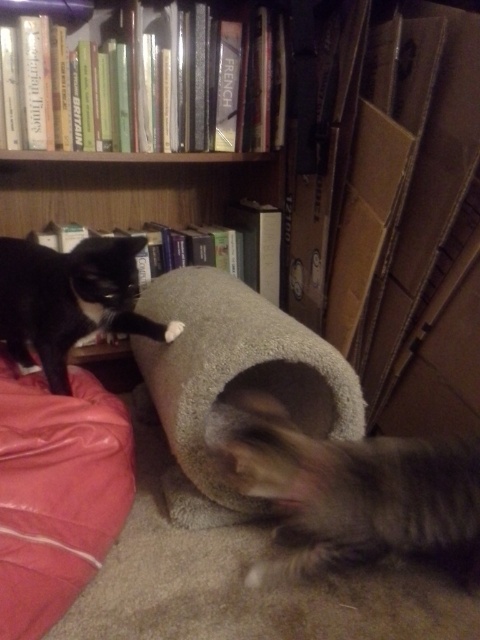
Question: Is soft gray carpeted tube at center thinner than wooden bookshelf at upper center?

Choices:
 (A) yes
 (B) no

Answer: (A)

Question: Among these points, which one is nearest to the camera?

Choices:
 (A) (301, 506)
 (B) (106, 262)
 (C) (43, 208)

Answer: (A)

Question: Which object is the closest to the red fabric cat bed at lower left?

Choices:
 (A) soft gray carpeted tube at center
 (B) fuzzy gray cat at lower right
 (C) black fur cat at upper left
 (D) wooden bookshelf at upper center

Answer: (C)

Question: Among these objects, which one is farthest from the camera?

Choices:
 (A) black fur cat at upper left
 (B) wooden bookshelf at upper center
 (C) soft gray carpeted tube at center
 (D) red fabric cat bed at lower left

Answer: (B)

Question: Can you confirm if red fabric cat bed at lower left is positioned below black fur cat at upper left?

Choices:
 (A) yes
 (B) no

Answer: (A)

Question: Can you confirm if soft gray carpeted tube at center is positioned to the left of wooden bookshelf at upper center?

Choices:
 (A) no
 (B) yes

Answer: (A)